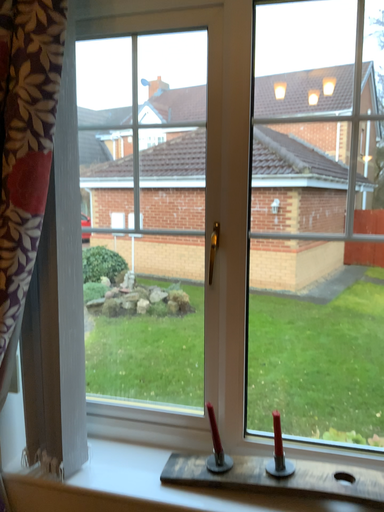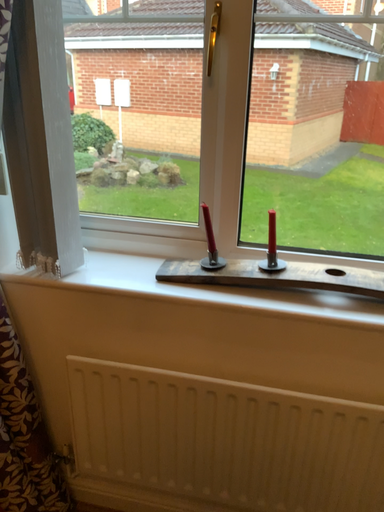
Question: Which way did the camera rotate in the video?

Choices:
 (A) rotated upward
 (B) rotated downward

Answer: (B)